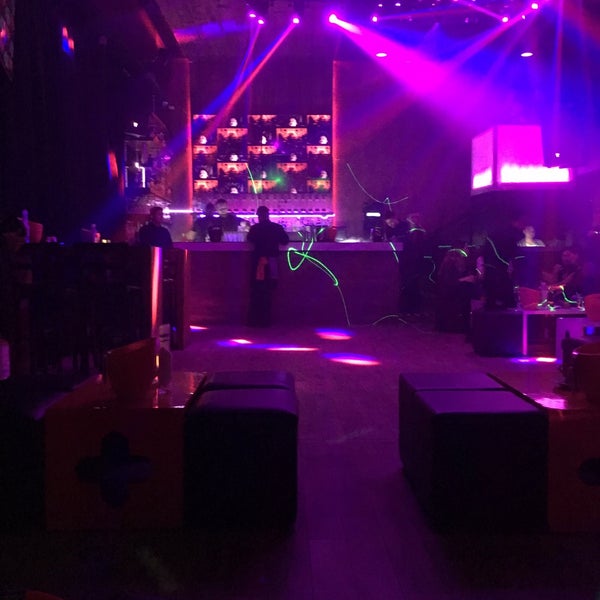
This screenshot has height=600, width=600. What are the coordinates of `bar` in the screenshot? It's located at (208, 244).